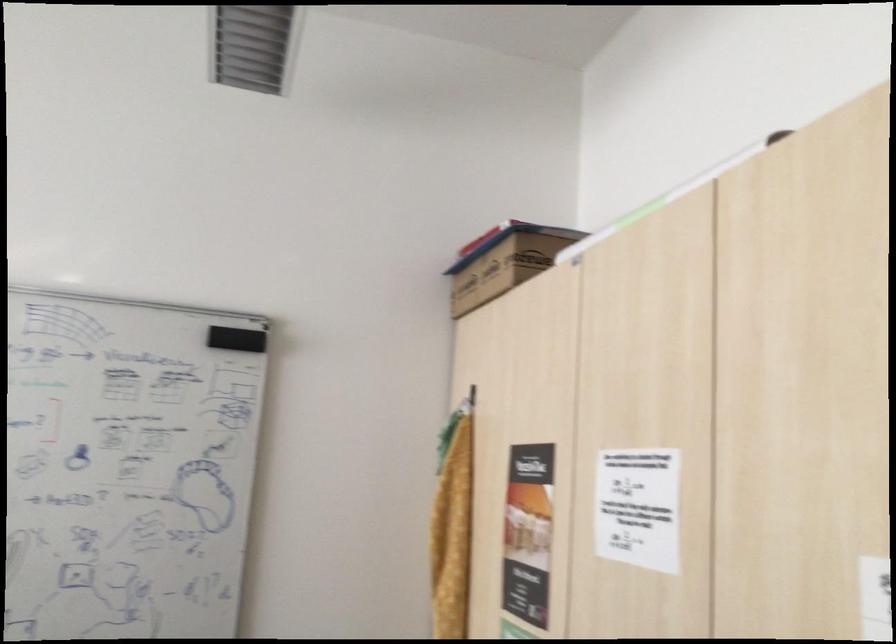
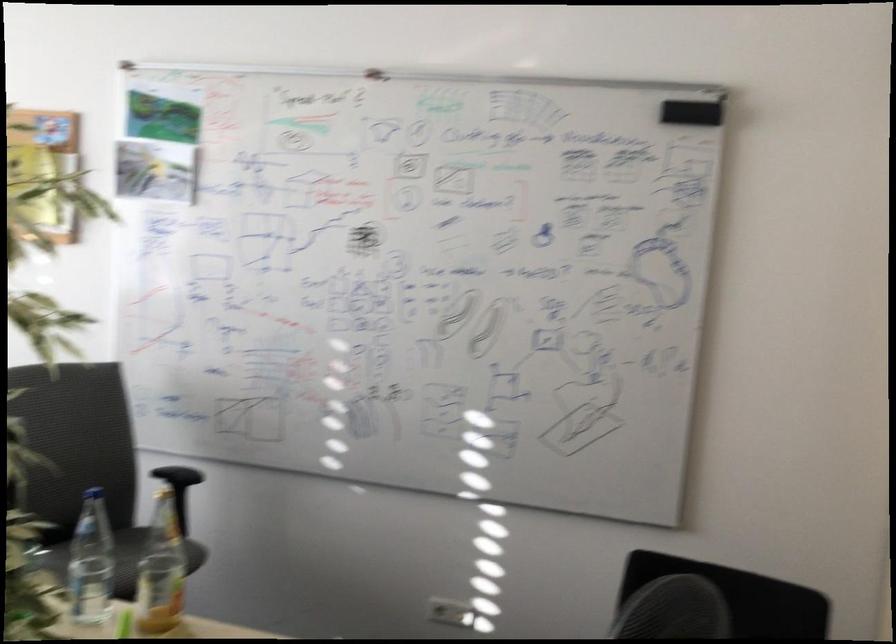
Question: How did the camera likely rotate?

Choices:
 (A) Left
 (B) Right
 (C) Up
 (D) Down

Answer: (A)